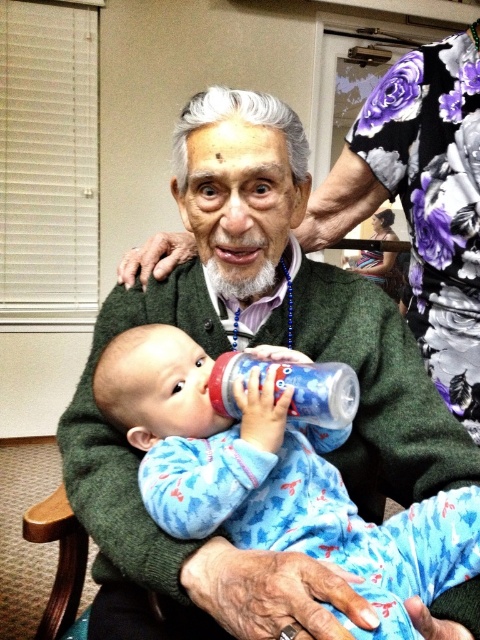
From the picture: Is blue fleece onesie at center shorter than floral fabric at upper right?

Yes.

Which is in front, point (219, 456) or point (415, 232)?

Point (219, 456)

Find the location of a particular element. The height and width of the screenshot is (640, 480). blue fleece onesie at center is located at coordinates (273, 477).

Find the location of a particular element. blue fleece onesie at center is located at coordinates (273, 477).

Can you confirm if floral fabric at upper right is wider than blue plastic bottle at center?

Yes, floral fabric at upper right is wider than blue plastic bottle at center.

Based on the photo, measure the distance between floral fabric at upper right and blue plastic bottle at center.

floral fabric at upper right is 60.30 centimeters from blue plastic bottle at center.

Find the location of a particular element. Image resolution: width=480 pixels, height=640 pixels. floral fabric at upper right is located at coordinates (421, 202).

Between blue fleece onesie at center and blue plastic bottle at center, which one appears on the left side from the viewer's perspective?

blue fleece onesie at center is more to the left.

Is blue fleece onesie at center positioned behind blue plastic bottle at center?

No, blue fleece onesie at center is in front of blue plastic bottle at center.

The height and width of the screenshot is (640, 480). What do you see at coordinates (273, 477) in the screenshot? I see `blue fleece onesie at center` at bounding box center [273, 477].

The image size is (480, 640). In order to click on blue fleece onesie at center in this screenshot , I will do `click(273, 477)`.